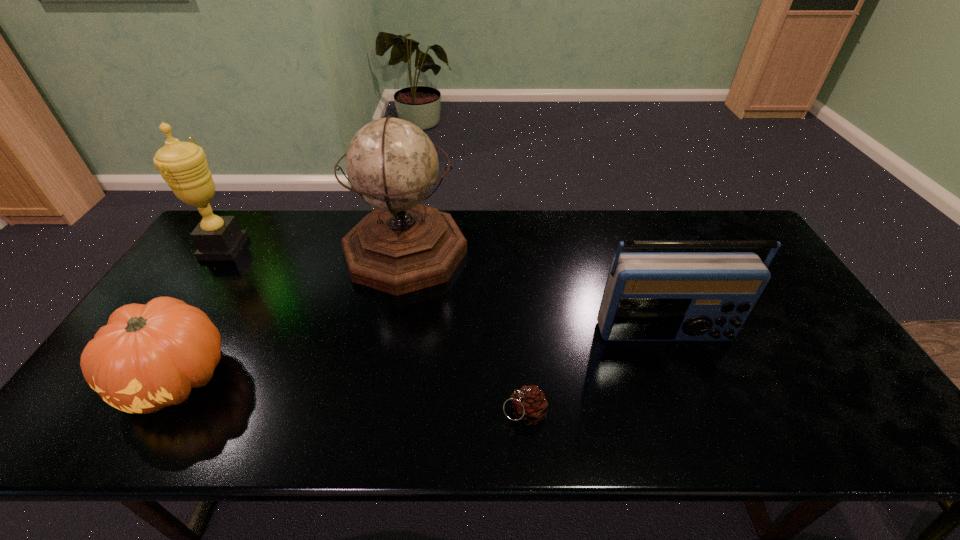
Where is `globe`? This screenshot has width=960, height=540. globe is located at coordinates (x=402, y=246).

This screenshot has height=540, width=960. I want to click on trophy cup, so click(183, 165).

I want to click on the rightmost object, so click(648, 296).

I want to click on the third shortest object, so click(x=648, y=296).

Locate an element on the screen. Image resolution: width=960 pixels, height=540 pixels. the second shortest object is located at coordinates (147, 357).

Find the location of `pinecone`. pinecone is located at coordinates (529, 405).

Find the location of a particular element. This screenshot has width=960, height=540. the shortest object is located at coordinates (529, 405).

Locate an element on the screen. blank space located 0.150m on the surface of the globe is located at coordinates (514, 252).

Where is `vacant space situated 0.210m at the front of the trophy cup with handles`? Image resolution: width=960 pixels, height=540 pixels. vacant space situated 0.210m at the front of the trophy cup with handles is located at coordinates (308, 248).

Identify the location of vacant region located on the front panel of the third shortest object. (680, 374).